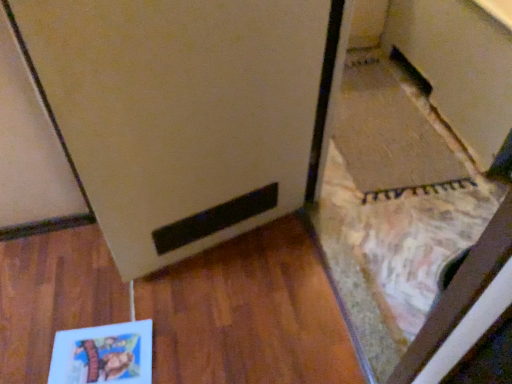
Identify the location of vacant area located to the right-hand side of matte paper book at lower left. (178, 330).